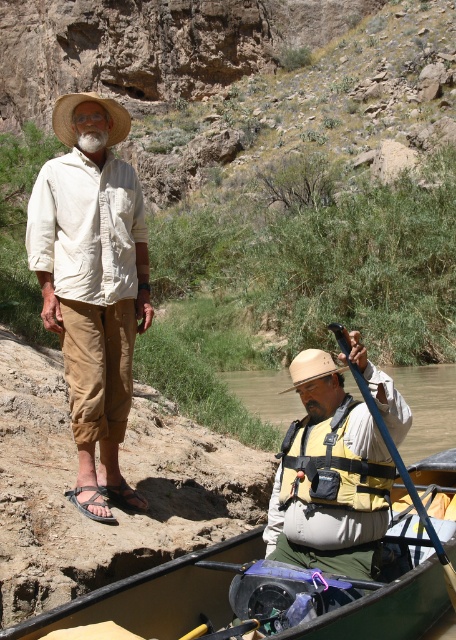
Which of these two, straw woven cowboy hat at upper left or straw hat at lower center, stands shorter?

straw hat at lower center is shorter.

At what (x,y) coordinates should I click in order to perform the action: click on straw woven cowboy hat at upper left. Please return your answer as a coordinate pair (x, y). Looking at the image, I should click on (82, 102).

Where is `straw woven cowboy hat at upper left`? Image resolution: width=456 pixels, height=640 pixels. straw woven cowboy hat at upper left is located at coordinates (82, 102).

Who is positioned more to the right, yellow life vest at center or yellow fabric life jacket at lower center?

yellow fabric life jacket at lower center is more to the right.

Does yellow life vest at center appear on the left side of yellow fabric life jacket at lower center?

Indeed, yellow life vest at center is positioned on the left side of yellow fabric life jacket at lower center.

Where is `yellow life vest at center`? yellow life vest at center is located at coordinates (338, 483).

Can you confirm if yellow life vest at center is positioned to the left of straw woven cowboy hat at upper left?

Incorrect, yellow life vest at center is not on the left side of straw woven cowboy hat at upper left.

Between yellow life vest at center and straw woven cowboy hat at upper left, which one appears on the left side from the viewer's perspective?

straw woven cowboy hat at upper left

Does point (347, 534) come closer to viewer compared to point (107, 104)?

Yes, it is in front of point (107, 104).

Locate an element on the screen. Image resolution: width=456 pixels, height=640 pixels. yellow life vest at center is located at coordinates (338, 483).